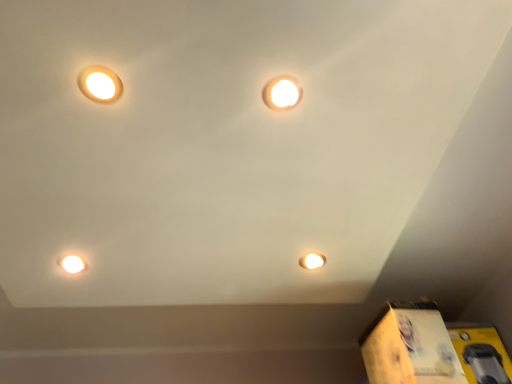
The height and width of the screenshot is (384, 512). In order to click on matte white lamp at upper left, marked as the 2th lamp in a right-to-left arrangement in this screenshot , I will do `click(100, 84)`.

Find the location of `matte white light at upper center, which is the second lamp from left to right`. matte white light at upper center, which is the second lamp from left to right is located at coordinates 282,93.

Measure the distance between point (286, 97) and camera.

They are 36.38 inches apart.

At what (x,y) coordinates should I click in order to perform the action: click on yellow cardboard box at lower right, acting as the 2th cardboard box starting from the left. Please return your answer as a coordinate pair (x, y). Image resolution: width=512 pixels, height=384 pixels. Looking at the image, I should click on (481, 353).

Locate an element on the screen. matte white lamp at upper left, which is counted as the 1th lamp, starting from the left is located at coordinates (100, 84).

How distant is matte white light bulb at lower left from matte white light at upper center, which is the second lamp from left to right?

31.37 inches.

From a real-world perspective, is matte white light bulb at lower left physically located above or below matte white light at upper center, which is the second lamp from left to right?

Clearly, from a real-world perspective, matte white light bulb at lower left is above matte white light at upper center, which is the second lamp from left to right.

Which is more to the left, matte white light bulb at lower left or matte white light at upper center, which is the second lamp from left to right?

matte white light bulb at lower left.

Is matte white light bulb at lower left far away from matte white light at upper center, which is the second lamp from left to right?

No, matte white light bulb at lower left is not far from matte white light at upper center, which is the second lamp from left to right.

From a real-world perspective, which object rests below the other?

yellow cardboard box at lower right, marked as the 1th cardboard box in a left-to-right arrangement, is physically lower.

How distant is matte white lamp at upper left, which is counted as the 1th lamp, starting from the left, from yellow cardboard box at lower right, which ranks as the second cardboard box in right-to-left order?

matte white lamp at upper left, which is counted as the 1th lamp, starting from the left, and yellow cardboard box at lower right, which ranks as the second cardboard box in right-to-left order, are 1.16 meters apart.

Considering the sizes of objects matte white lamp at upper left, marked as the 2th lamp in a right-to-left arrangement, and yellow cardboard box at lower right, marked as the 1th cardboard box in a left-to-right arrangement, in the image provided, who is shorter, matte white lamp at upper left, marked as the 2th lamp in a right-to-left arrangement, or yellow cardboard box at lower right, marked as the 1th cardboard box in a left-to-right arrangement,?

With less height is matte white lamp at upper left, marked as the 2th lamp in a right-to-left arrangement.

Considering the sizes of objects yellow cardboard box at lower right, which ranks as the first cardboard box in right-to-left order, and matte white light bulb at lower left in the image provided, who is smaller, yellow cardboard box at lower right, which ranks as the first cardboard box in right-to-left order, or matte white light bulb at lower left?

matte white light bulb at lower left.

Between yellow cardboard box at lower right, which ranks as the first cardboard box in right-to-left order, and matte white light bulb at lower left, which one appears on the right side from the viewer's perspective?

yellow cardboard box at lower right, which ranks as the first cardboard box in right-to-left order, is more to the right.

Considering their positions, is yellow cardboard box at lower right, which ranks as the first cardboard box in right-to-left order, located in front of or behind matte white light bulb at lower left?

Clearly, yellow cardboard box at lower right, which ranks as the first cardboard box in right-to-left order, is behind matte white light bulb at lower left.

Does yellow cardboard box at lower right, which ranks as the first cardboard box in right-to-left order, have a greater width compared to matte white light bulb at lower left?

Incorrect, the width of yellow cardboard box at lower right, which ranks as the first cardboard box in right-to-left order, does not surpass that of matte white light bulb at lower left.

Find the location of a particular element. cardboard box on the left of yellow cardboard box at lower right, which ranks as the first cardboard box in right-to-left order is located at coordinates (410, 346).

From the image's perspective, is yellow cardboard box at lower right, acting as the 2th cardboard box starting from the left, above or below yellow cardboard box at lower right, which ranks as the second cardboard box in right-to-left order?

Clearly, from the image's perspective, yellow cardboard box at lower right, acting as the 2th cardboard box starting from the left, is above yellow cardboard box at lower right, which ranks as the second cardboard box in right-to-left order.

Can yellow cardboard box at lower right, which ranks as the second cardboard box in right-to-left order, be found inside yellow cardboard box at lower right, acting as the 2th cardboard box starting from the left?

No, yellow cardboard box at lower right, which ranks as the second cardboard box in right-to-left order, is not surrounded by yellow cardboard box at lower right, acting as the 2th cardboard box starting from the left.

Considering the relative sizes of yellow cardboard box at lower right, which ranks as the first cardboard box in right-to-left order, and yellow cardboard box at lower right, which ranks as the second cardboard box in right-to-left order, in the image provided, is yellow cardboard box at lower right, which ranks as the first cardboard box in right-to-left order, shorter than yellow cardboard box at lower right, which ranks as the second cardboard box in right-to-left order,?

Yes.

Looking at this image, considering the sizes of yellow cardboard box at lower right, marked as the 1th cardboard box in a left-to-right arrangement, and matte white lamp at upper left, which is counted as the 1th lamp, starting from the left, in the image, is yellow cardboard box at lower right, marked as the 1th cardboard box in a left-to-right arrangement, taller or shorter than matte white lamp at upper left, which is counted as the 1th lamp, starting from the left,?

yellow cardboard box at lower right, marked as the 1th cardboard box in a left-to-right arrangement, is taller than matte white lamp at upper left, which is counted as the 1th lamp, starting from the left.

Is yellow cardboard box at lower right, marked as the 1th cardboard box in a left-to-right arrangement, positioned in front of matte white lamp at upper left, which is counted as the 1th lamp, starting from the left?

No, yellow cardboard box at lower right, marked as the 1th cardboard box in a left-to-right arrangement, is behind matte white lamp at upper left, which is counted as the 1th lamp, starting from the left.

Is yellow cardboard box at lower right, which ranks as the second cardboard box in right-to-left order, with matte white lamp at upper left, which is counted as the 1th lamp, starting from the left?

yellow cardboard box at lower right, which ranks as the second cardboard box in right-to-left order, and matte white lamp at upper left, which is counted as the 1th lamp, starting from the left, are not in contact.

Is point (447, 381) positioned after point (109, 92)?

Yes.

Measure the distance between matte white light at upper center, the 1th lamp in the right-to-left sequence, and yellow cardboard box at lower right, acting as the 2th cardboard box starting from the left.

matte white light at upper center, the 1th lamp in the right-to-left sequence, and yellow cardboard box at lower right, acting as the 2th cardboard box starting from the left, are 1.08 meters apart.

From a real-world perspective, is matte white light at upper center, which is the second lamp from left to right, under yellow cardboard box at lower right, which ranks as the first cardboard box in right-to-left order?

Answer: No.

Can you confirm if matte white light at upper center, the 1th lamp in the right-to-left sequence, is smaller than yellow cardboard box at lower right, acting as the 2th cardboard box starting from the left?

Indeed, matte white light at upper center, the 1th lamp in the right-to-left sequence, has a smaller size compared to yellow cardboard box at lower right, acting as the 2th cardboard box starting from the left.

Is matte white light at upper center, the 1th lamp in the right-to-left sequence, positioned with its back to yellow cardboard box at lower right, which ranks as the first cardboard box in right-to-left order?

No.

Can you confirm if matte white light bulb at lower left is shorter than yellow cardboard box at lower right, acting as the 2th cardboard box starting from the left?

Indeed, matte white light bulb at lower left has a lesser height compared to yellow cardboard box at lower right, acting as the 2th cardboard box starting from the left.

Between matte white light bulb at lower left and yellow cardboard box at lower right, which ranks as the first cardboard box in right-to-left order, which one appears on the left side from the viewer's perspective?

From the viewer's perspective, matte white light bulb at lower left appears more on the left side.

Is matte white light bulb at lower left far away from yellow cardboard box at lower right, which ranks as the first cardboard box in right-to-left order?

Yes, matte white light bulb at lower left is far from yellow cardboard box at lower right, which ranks as the first cardboard box in right-to-left order.

From a real-world perspective, is matte white light bulb at lower left positioned above or below yellow cardboard box at lower right, which ranks as the first cardboard box in right-to-left order?

In terms of real-world spatial position, matte white light bulb at lower left is above yellow cardboard box at lower right, which ranks as the first cardboard box in right-to-left order.

Find the location of a particular element. The height and width of the screenshot is (384, 512). the 1st lamp above the matte white light bulb at lower left (from the image's perspective) is located at coordinates (282, 93).

This screenshot has height=384, width=512. What are the coordinates of `the 2nd cardboard box below the matte white lamp at upper left, marked as the 2th lamp in a right-to-left arrangement (from the image's perspective)` in the screenshot? It's located at (410, 346).

Considering their positions, is yellow cardboard box at lower right, which ranks as the second cardboard box in right-to-left order, positioned further to matte white light at upper center, the 1th lamp in the right-to-left sequence, than matte white lamp at upper left, which is counted as the 1th lamp, starting from the left?

yellow cardboard box at lower right, which ranks as the second cardboard box in right-to-left order, is further to matte white light at upper center, the 1th lamp in the right-to-left sequence.

Estimate the real-world distances between objects in this image. Which object is further from yellow cardboard box at lower right, which ranks as the first cardboard box in right-to-left order, matte white light at upper center, which is the second lamp from left to right, or matte white lamp at upper left, marked as the 2th lamp in a right-to-left arrangement?

The object further to yellow cardboard box at lower right, which ranks as the first cardboard box in right-to-left order, is matte white lamp at upper left, marked as the 2th lamp in a right-to-left arrangement.

From the image, which object appears to be farther from matte white light bulb at lower left, matte white lamp at upper left, marked as the 2th lamp in a right-to-left arrangement, or yellow cardboard box at lower right, which ranks as the first cardboard box in right-to-left order?

yellow cardboard box at lower right, which ranks as the first cardboard box in right-to-left order, is further to matte white light bulb at lower left.

Looking at the image, which one is located further to yellow cardboard box at lower right, acting as the 2th cardboard box starting from the left, matte white lamp at upper left, which is counted as the 1th lamp, starting from the left, or matte white light at upper center, which is the second lamp from left to right?

Based on the image, matte white lamp at upper left, which is counted as the 1th lamp, starting from the left, appears to be further to yellow cardboard box at lower right, acting as the 2th cardboard box starting from the left.

From the image, which object appears to be farther from yellow cardboard box at lower right, acting as the 2th cardboard box starting from the left, matte white lamp at upper left, which is counted as the 1th lamp, starting from the left, or matte white light bulb at lower left?

The object further to yellow cardboard box at lower right, acting as the 2th cardboard box starting from the left, is matte white lamp at upper left, which is counted as the 1th lamp, starting from the left.

Looking at the image, which one is located closer to matte white light bulb at lower left, yellow cardboard box at lower right, which ranks as the second cardboard box in right-to-left order, or matte white light at upper center, which is the second lamp from left to right?

matte white light at upper center, which is the second lamp from left to right, lies closer to matte white light bulb at lower left than the other object.

Considering their positions, is matte white light at upper center, the 1th lamp in the right-to-left sequence, positioned closer to matte white light bulb at lower left than matte white lamp at upper left, marked as the 2th lamp in a right-to-left arrangement?

Based on the image, matte white lamp at upper left, marked as the 2th lamp in a right-to-left arrangement, appears to be nearer to matte white light bulb at lower left.

When comparing their distances from yellow cardboard box at lower right, acting as the 2th cardboard box starting from the left, does matte white light bulb at lower left or matte white light at upper center, which is the second lamp from left to right, seem further?

matte white light bulb at lower left lies further to yellow cardboard box at lower right, acting as the 2th cardboard box starting from the left, than the other object.

This screenshot has width=512, height=384. Identify the location of cardboard box between matte white light at upper center, the 1th lamp in the right-to-left sequence, and yellow cardboard box at lower right, marked as the 1th cardboard box in a left-to-right arrangement, in the vertical direction. (481, 353).

At what (x,y) coordinates should I click in order to perform the action: click on cardboard box located between matte white lamp at upper left, marked as the 2th lamp in a right-to-left arrangement, and yellow cardboard box at lower right, which ranks as the first cardboard box in right-to-left order, in the left-right direction. Please return your answer as a coordinate pair (x, y). The height and width of the screenshot is (384, 512). Looking at the image, I should click on (410, 346).

You are a GUI agent. You are given a task and a screenshot of the screen. Output one action in this format:
    pyautogui.click(x=<x>, y=<y>)
    Task: Click on the cardboard box located between matte white light bulb at lower left and yellow cardboard box at lower right, acting as the 2th cardboard box starting from the left, in the left-right direction
    Image resolution: width=512 pixels, height=384 pixels.
    Given the screenshot: What is the action you would take?
    pyautogui.click(x=410, y=346)

Where is `lamp between matte white lamp at upper left, which is counted as the 1th lamp, starting from the left, and yellow cardboard box at lower right, which ranks as the second cardboard box in right-to-left order, from top to bottom`? The width and height of the screenshot is (512, 384). lamp between matte white lamp at upper left, which is counted as the 1th lamp, starting from the left, and yellow cardboard box at lower right, which ranks as the second cardboard box in right-to-left order, from top to bottom is located at coordinates (282, 93).